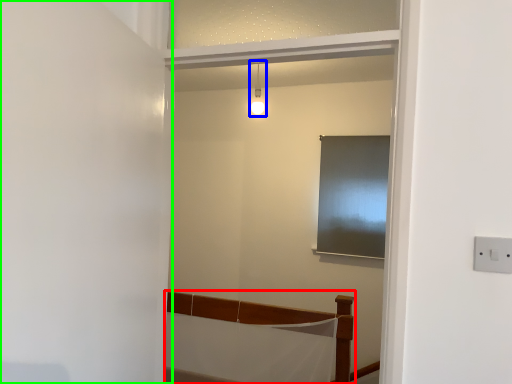
Question: Based on their relative distances, which object is nearer to furniture (highlighted by a red box)? Choose from light fixture (highlighted by a blue box) and door (highlighted by a green box).

Choices:
 (A) light fixture
 (B) door

Answer: (B)